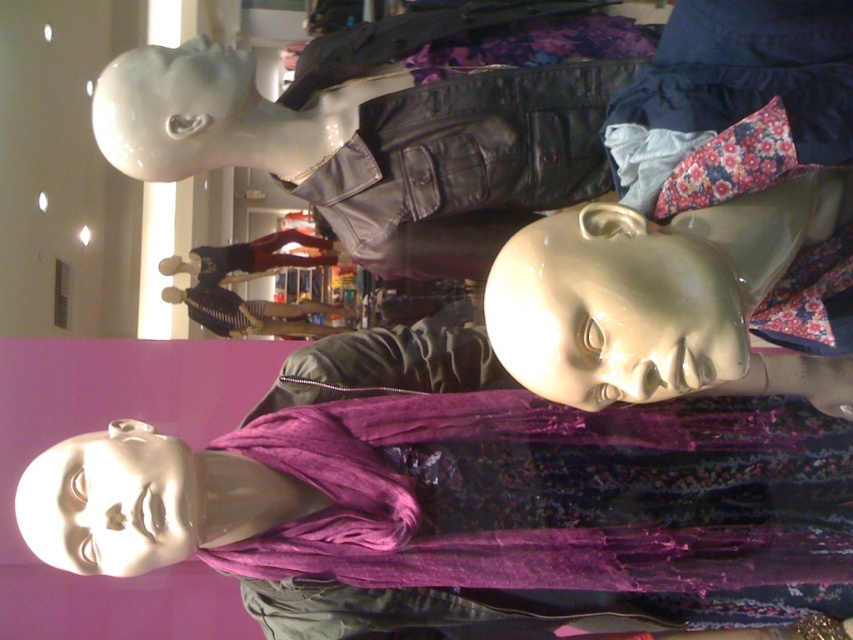
Question: Is the position of matte white face at center less distant than that of glossy white head at upper center?

Choices:
 (A) yes
 (B) no

Answer: (A)

Question: Which object is closer to the camera taking this photo?

Choices:
 (A) glossy plastic head at center
 (B) matte white face at center
 (C) glossy white head at upper center

Answer: (A)

Question: Does glossy plastic head at center have a lesser width compared to glossy white head at upper center?

Choices:
 (A) no
 (B) yes

Answer: (A)

Question: Is matte white face at center smaller than glossy white head at upper center?

Choices:
 (A) yes
 (B) no

Answer: (A)

Question: Among these objects, which one is farthest from the camera?

Choices:
 (A) matte white face at center
 (B) glossy white head at upper center

Answer: (B)

Question: Which object appears closest to the camera in this image?

Choices:
 (A) glossy plastic head at center
 (B) matte white face at center

Answer: (A)